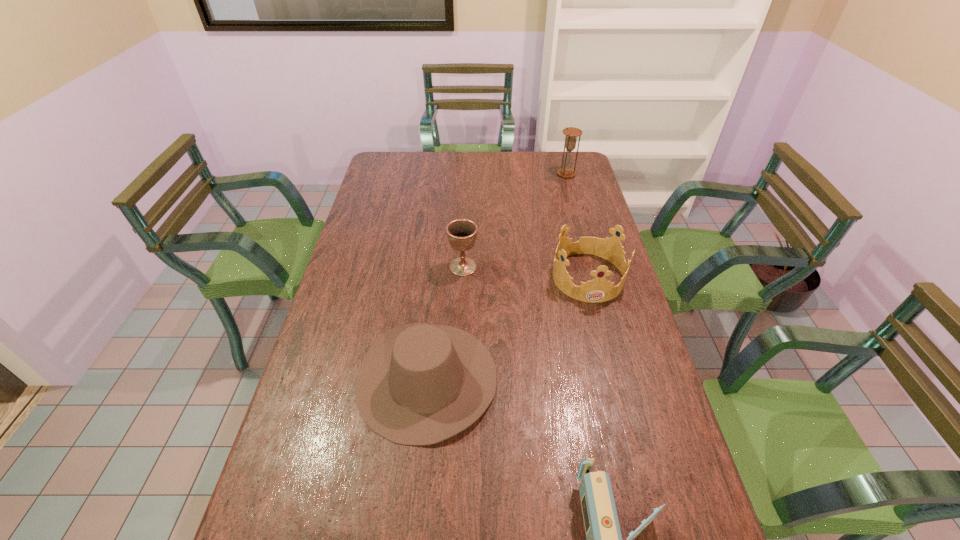
The height and width of the screenshot is (540, 960). I want to click on vacant area that lies between the hourglass and the tiara, so click(x=577, y=225).

Find the location of a particular element. the third closest object to the chalice is located at coordinates (566, 171).

Select which object appears as the fourth closest to the chalice. Please provide its 2D coordinates. Your answer should be formatted as a tuple, i.e. [(x, y)], where the tuple contains the x and y coordinates of a point satisfying the conditions above.

[(604, 539)]